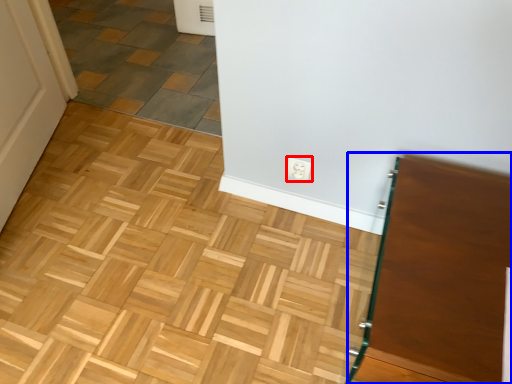
Question: Which point is closer to the camera, electric outlet (highlighted by a red box) or vanity (highlighted by a blue box)?

Choices:
 (A) electric outlet
 (B) vanity

Answer: (B)